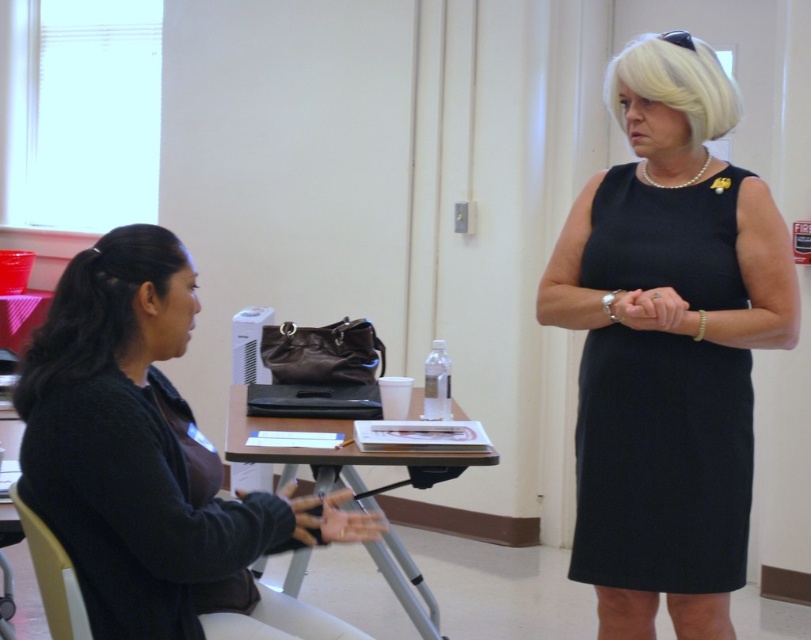
You are trying to determine if the dark gray sweater at left can be placed on the white plastic chair at lower left. Based on their sizes, will it fit without falling off?

The dark gray sweater at left is wider than the white plastic chair at lower left, so placing it might cause it to fall off due to the width difference.

You are a delivery person who needs to place a small package between the dark gray sweater at left and the white plastic chair at lower left. Is there enough space to fit the package, which is 12 inches long?

The distance between the dark gray sweater at left and the white plastic chair at lower left is 11.04 inches, so the package that is 12 inches long cannot fit in that space.

You are an interior designer planning to place a new lamp in this room. The lamp requires a space of 0.2 meters in width. Can the dark gray sweater at left be moved to accommodate the lamp without overlapping any other objects?

The dark gray sweater at left is located at point (152, 461). Since the lamp requires 0.2 meters in width, you need to check if there is enough space around the sweater. However, without knowing the exact dimensions of the sweater or the surrounding objects, it is uncertain if the space is sufficient. Please provide more details about the sweater and nearby items.